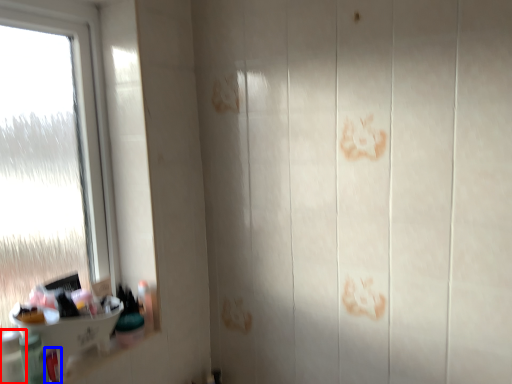
Question: Among these objects, which one is farthest to the camera, toiletry (highlighted by a red box) or toiletry (highlighted by a blue box)?

Choices:
 (A) toiletry
 (B) toiletry

Answer: (B)